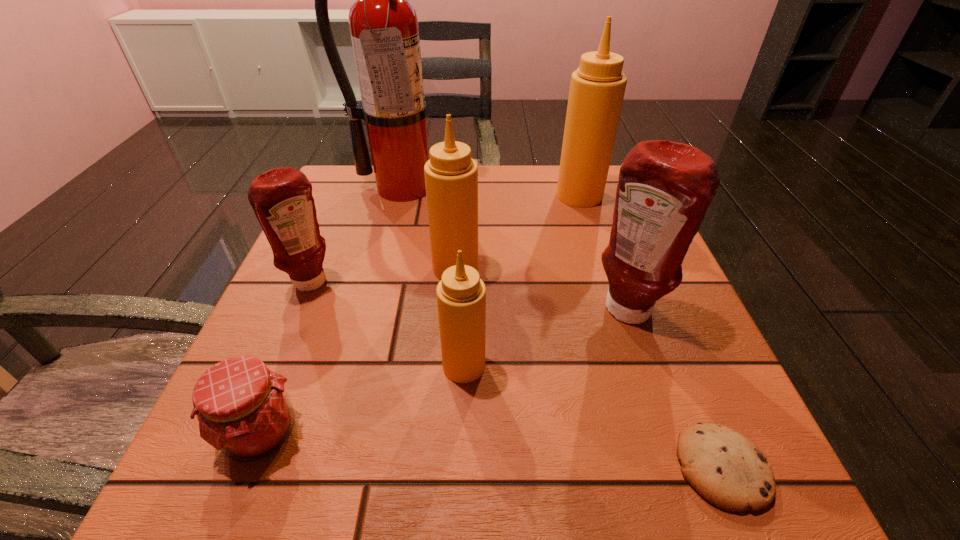
Locate an element on the screen. jam is located at coordinates (243, 409).

Locate an element on the screen. the second shortest object is located at coordinates (243, 409).

Where is `the shortest object`? the shortest object is located at coordinates (727, 469).

At what (x,y) coordinates should I click in order to perform the action: click on vacant space positioned 0.080m on the nozzle side of the tallest object. Please return your answer as a coordinate pair (x, y). The width and height of the screenshot is (960, 540). Looking at the image, I should click on (394, 223).

The height and width of the screenshot is (540, 960). In order to click on vacant area situated on the right of the second tallest object in this screenshot , I will do `click(628, 195)`.

Where is `vacant space located on the left of the bigger red condiment`? vacant space located on the left of the bigger red condiment is located at coordinates (453, 313).

Identify the location of vacant space located on the left of the second nearest tan condiment. (313, 268).

You are a GUI agent. You are given a task and a screenshot of the screen. Output one action in this format:
    pyautogui.click(x=<x>, y=<y>)
    Task: Click on the vacant area located on the back of the left red condiment
    The width and height of the screenshot is (960, 540).
    Given the screenshot: What is the action you would take?
    pyautogui.click(x=329, y=242)

I want to click on vacant point located on the back of the sixth farthest object, so click(467, 293).

Find the location of a particular element. Image resolution: width=960 pixels, height=540 pixels. vacant position located 0.310m on the back of the jam is located at coordinates (329, 260).